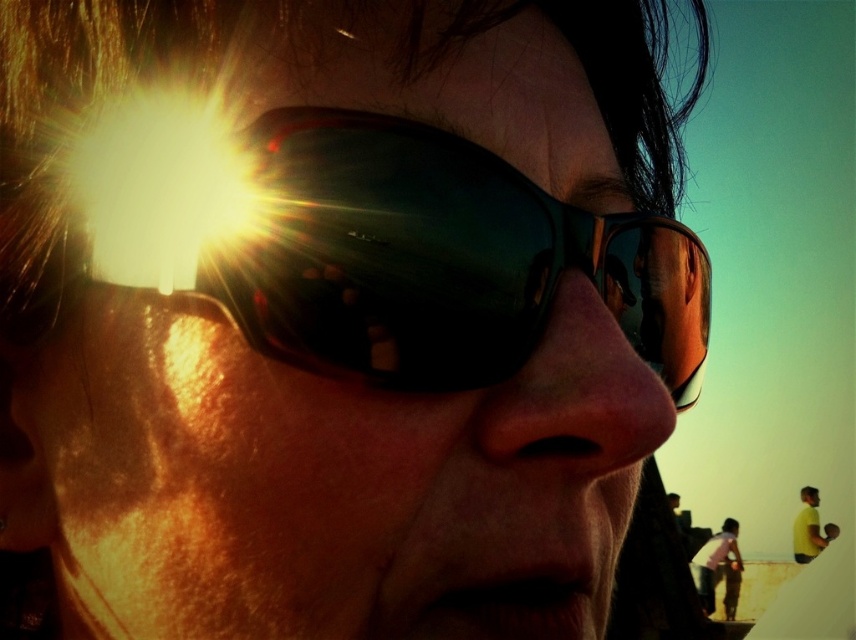
Question: Which point is farther to the camera?

Choices:
 (A) light pink shirt at lower right
 (B) shiny black goggles at center

Answer: (A)

Question: Can you confirm if shiny black goggles at center is smaller than yellow matte shirt at lower right?

Choices:
 (A) no
 (B) yes

Answer: (B)

Question: Which object appears farthest from the camera in this image?

Choices:
 (A) shiny black goggles at center
 (B) yellow matte shirt at lower right

Answer: (B)

Question: Does shiny black goggles at center have a greater width compared to light pink shirt at lower right?

Choices:
 (A) yes
 (B) no

Answer: (B)

Question: Which object is farther from the camera taking this photo?

Choices:
 (A) yellow matte shirt at lower right
 (B) light pink shirt at lower right

Answer: (A)

Question: Can you confirm if shiny black goggles at center is smaller than light pink shirt at lower right?

Choices:
 (A) no
 (B) yes

Answer: (B)